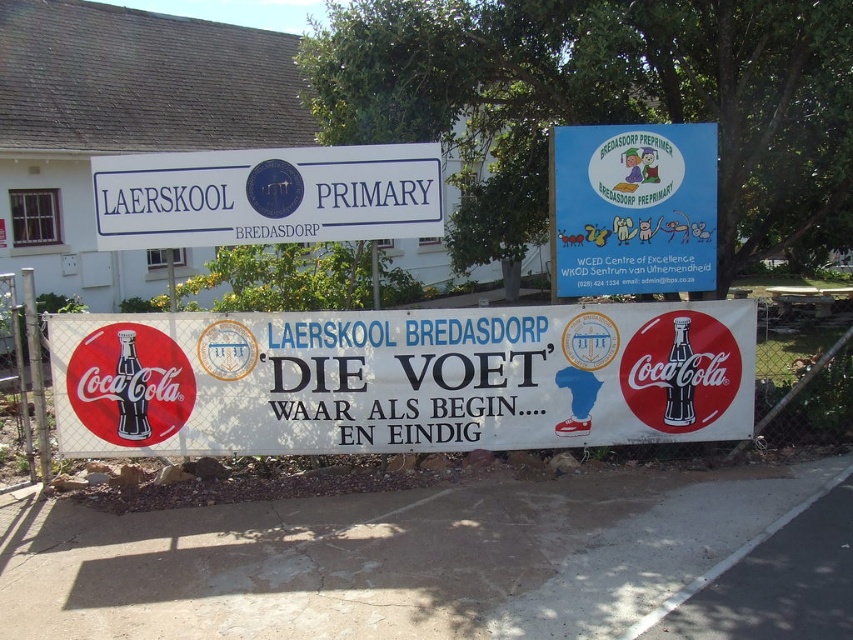
Who is lower down, white plastic signboard at upper center or blue paper sign at upper right?

blue paper sign at upper right is lower down.

Who is taller, white plastic signboard at upper center or blue paper sign at upper right?

With more height is blue paper sign at upper right.

This screenshot has height=640, width=853. What do you see at coordinates (267, 195) in the screenshot?
I see `white plastic signboard at upper center` at bounding box center [267, 195].

In order to click on white plastic signboard at upper center in this screenshot , I will do `click(267, 195)`.

Based on the photo, does blue paper sign at upper right have a lesser width compared to matte black bottle at center?

In fact, blue paper sign at upper right might be wider than matte black bottle at center.

Is blue paper sign at upper right wider than matte black bottle at center?

Yes, blue paper sign at upper right is wider than matte black bottle at center.

Which is behind, point (666, 211) or point (126, 330)?

The point (666, 211) is behind.

Identify the location of blue paper sign at upper right. click(x=633, y=209).

Is point (164, 163) positioned behind point (663, 378)?

No, (164, 163) is closer to viewer.

Which is in front, point (225, 237) or point (683, 372)?

Point (225, 237) is in front.

Where is `white plastic signboard at upper center`? This screenshot has height=640, width=853. white plastic signboard at upper center is located at coordinates (267, 195).